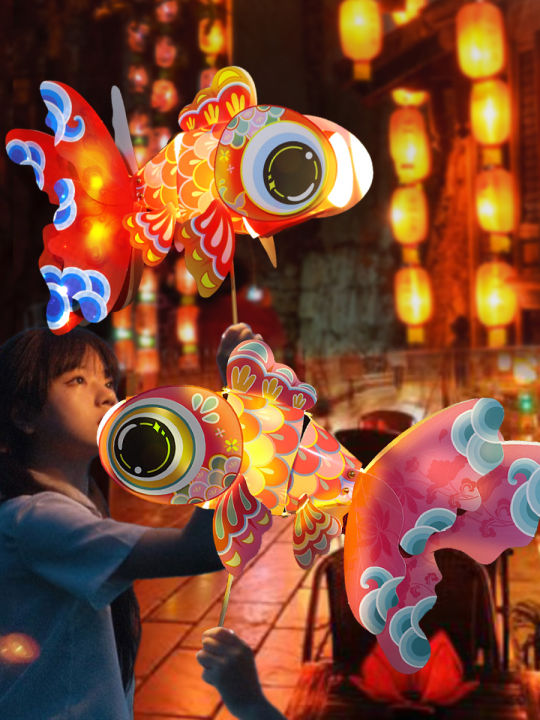
You are a GUI agent. You are given a task and a screenshot of the screen. Output one action in this format:
    pyautogui.click(x=<x>, y=<y>)
    Task: Click on the chair
    The height and width of the screenshot is (720, 540).
    Given the screenshot: What is the action you would take?
    click(361, 443)